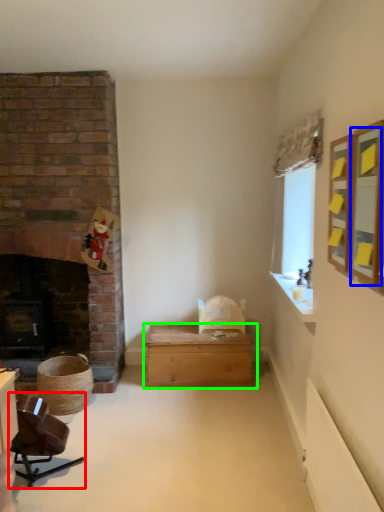
Question: Which is nearer to the chair (highlighted by a red box)? mirror (highlighted by a blue box) or table (highlighted by a green box).

Choices:
 (A) mirror
 (B) table

Answer: (B)